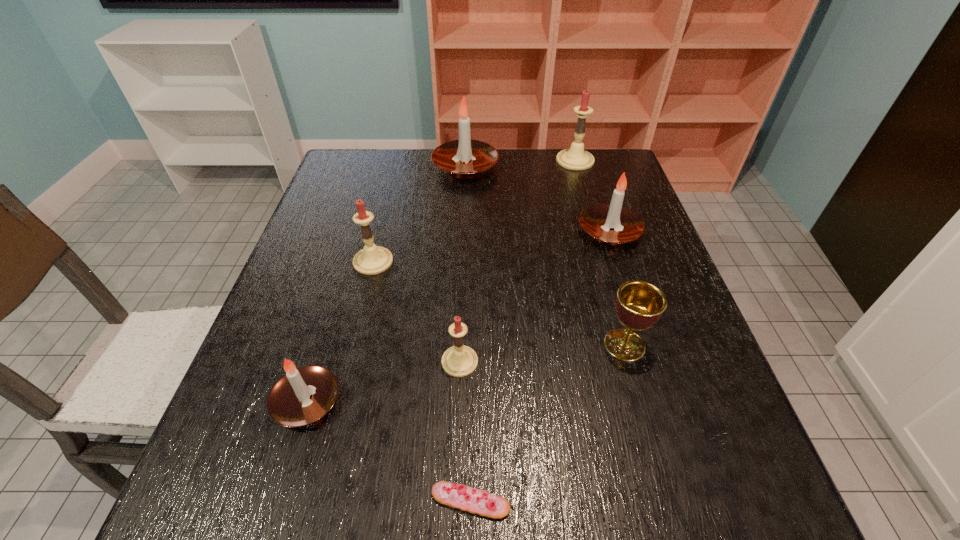
Where is `the biggest white candle`? This screenshot has width=960, height=540. the biggest white candle is located at coordinates (465, 158).

Find the location of a particular element. The height and width of the screenshot is (540, 960). the second white candle from left to right is located at coordinates (465, 158).

Image resolution: width=960 pixels, height=540 pixels. Find the location of `the rightmost red candle`. the rightmost red candle is located at coordinates (576, 158).

This screenshot has height=540, width=960. I want to click on the biggest red candle, so click(x=576, y=158).

Find the location of `the rightmost white candle`. the rightmost white candle is located at coordinates [596, 220].

You are a GUI agent. You are given a task and a screenshot of the screen. Output one action in this format:
    pyautogui.click(x=<x>, y=<y>)
    Task: Click on the second biggest white candle
    The height and width of the screenshot is (540, 960).
    Given the screenshot: What is the action you would take?
    pyautogui.click(x=596, y=220)

Find the location of a particular element. Image resolution: width=960 pixels, height=540 pixels. the second farthest red candle is located at coordinates (371, 260).

At what (x,y) coordinates should I click in order to perform the action: click on the leftmost red candle. Please return your answer as a coordinate pair (x, y). The image size is (960, 540). Looking at the image, I should click on (371, 260).

Image resolution: width=960 pixels, height=540 pixels. In order to click on golden chalice in this screenshot , I will do `click(639, 305)`.

Find the location of a particular element. the smallest white candle is located at coordinates (303, 395).